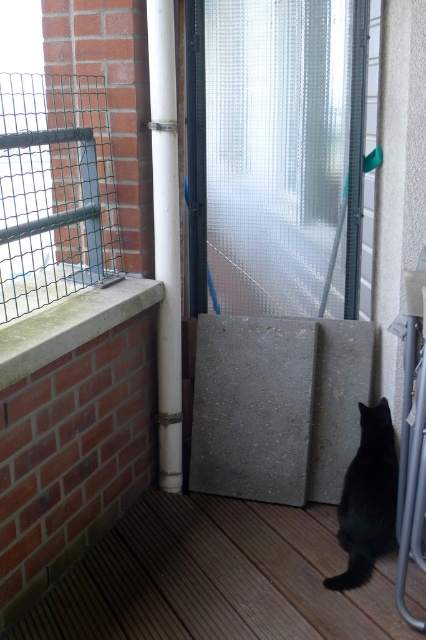
You are standing on the balcony and want to place a potted plant between the brown wooden deck at lower center and the white plastic pipe at center. Based on their positions, which object should the plant be closer to?

The brown wooden deck at lower center is to the right of the white plastic pipe at center, so the plant should be placed closer to the white plastic pipe at center to be between them.

You are trying to determine if the frosted glass door at center can fit through the space where the concrete ledge at upper left is located. Based on their sizes, is this possible?

The frosted glass door at center might be wider than concrete ledge at upper left, so it may not fit through that space.